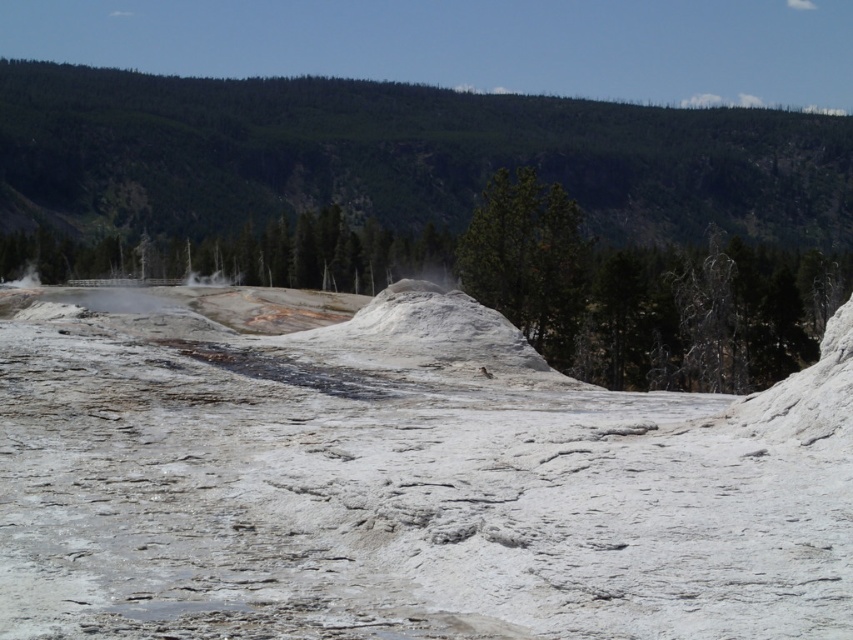
You are standing at the edge of the white, mineral deposits in the foreground of the geothermal landscape. You notice a point marked at coordinates (398, 477). What is located at that point?

The white matte snow at center is located at point (398, 477).

You are planning a hiking route from the green forested mountain at upper center to the white matte snow at center. Given that the average human walking pace is about 3 miles per hour, approximately how long would it take to walk between them?

The white matte snow at center and green forested mountain at upper center are 727.33 feet apart from each other. Converting feet to miles, 727.33 feet is approximately 0.137 miles. At a walking pace of 3 miles per hour, it would take roughly 2.74 minutes to walk between them.

You are taking a photo of the geothermal landscape and want to focus on both point (270,531) and point (135,161). Which point should you adjust your focus to first to ensure the closer one is sharp?

Point (270,531) is closer to the camera than point (135,161), so you should focus on point (270,531) first to ensure it is sharp.